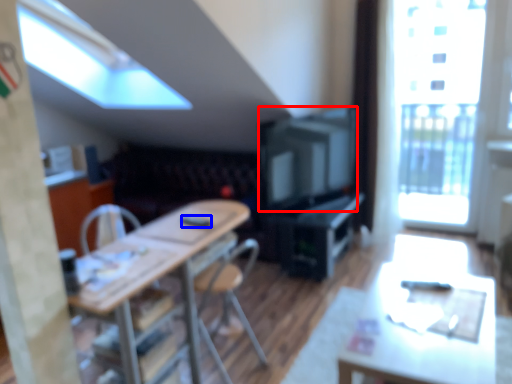
Question: Which point is closer to the camera, television (highlighted by a red box) or remote control (highlighted by a blue box)?

Choices:
 (A) television
 (B) remote control

Answer: (B)